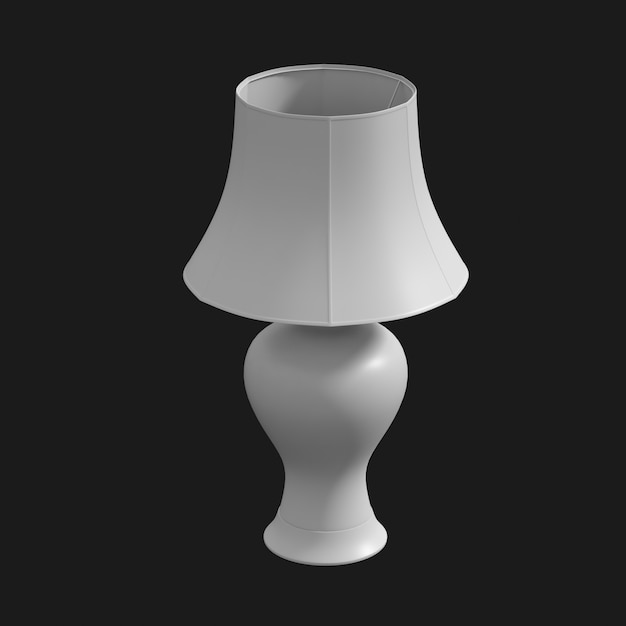
Identify the location of lampshade. (305, 239).